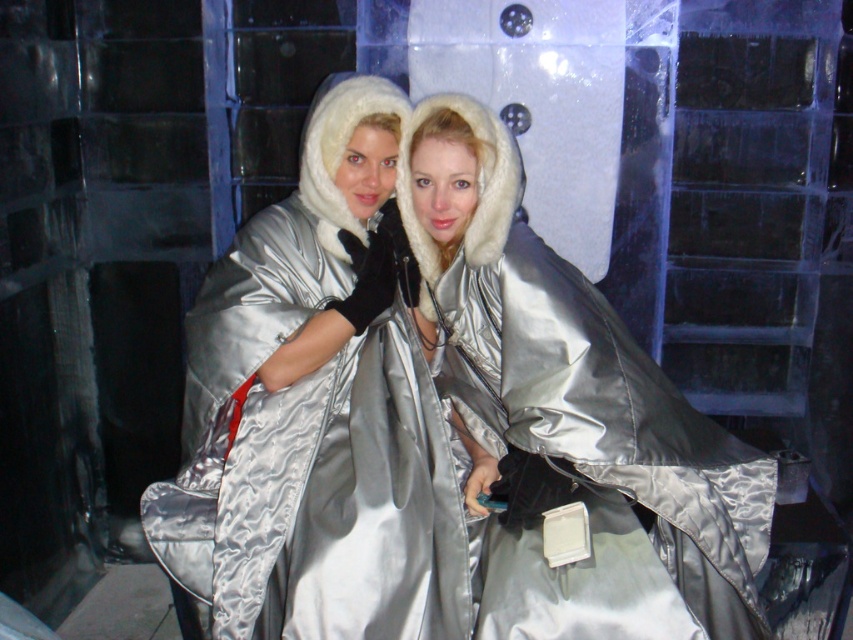
Consider the image. Who is more distant from viewer, (265, 561) or (508, 136)?

The point (508, 136) is behind.

Which is above, satin silver coat at center or satin silver cape at center?

satin silver coat at center

Who is more forward, (x=351, y=472) or (x=671, y=525)?

Point (x=351, y=472) is in front.

At what (x,y) coordinates should I click in order to perform the action: click on satin silver coat at center. Please return your answer as a coordinate pair (x, y). Looking at the image, I should click on (312, 422).